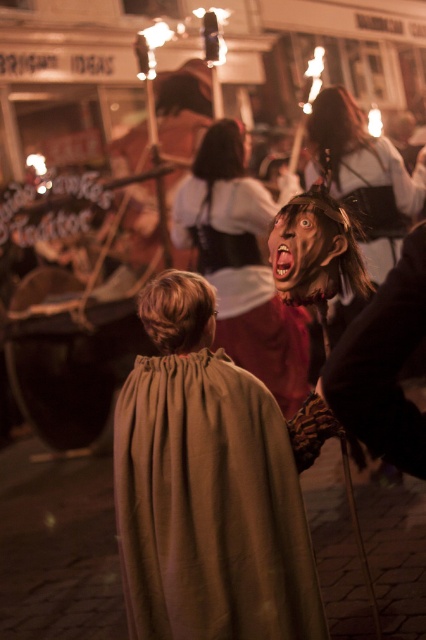
Question: Can you confirm if brown cotton cape at center is positioned to the right of smooth brown mask at center?

Choices:
 (A) no
 (B) yes

Answer: (A)

Question: Estimate the real-world distances between objects in this image. Which object is farther from the brown cotton cape at center?

Choices:
 (A) smooth matte face at center
 (B) smooth brown mask at center

Answer: (B)

Question: Estimate the real-world distances between objects in this image. Which object is closer to the smooth matte face at center?

Choices:
 (A) brown cotton cape at center
 (B) smooth brown mask at center

Answer: (A)

Question: Is brown cotton cape at center behind smooth brown mask at center?

Choices:
 (A) yes
 (B) no

Answer: (B)

Question: Which of the following is the farthest from the observer?

Choices:
 (A) (218, 362)
 (B) (314, 237)

Answer: (A)

Question: Is brown cotton cape at center to the right of smooth matte face at center from the viewer's perspective?

Choices:
 (A) no
 (B) yes

Answer: (A)